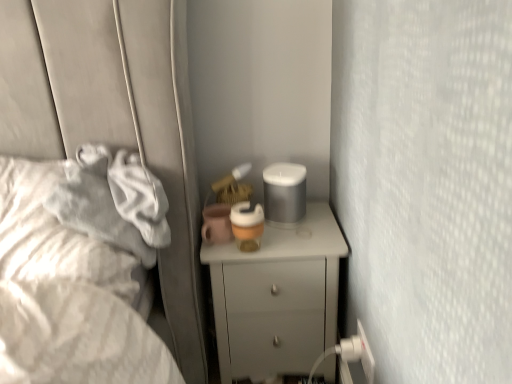
The height and width of the screenshot is (384, 512). Describe the element at coordinates (67, 295) in the screenshot. I see `white soft fabric at left` at that location.

At what (x,y) coordinates should I click in order to perform the action: click on white plastic electric outlet at lower right. Please return your answer as a coordinate pair (x, y). The image size is (512, 384). Looking at the image, I should click on (356, 356).

You are a GUI agent. You are given a task and a screenshot of the screen. Output one action in this format:
    pyautogui.click(x=<x>, y=<y>)
    Task: Click on the white soft fabric at left
    The image size is (512, 384).
    Given the screenshot: What is the action you would take?
    pyautogui.click(x=67, y=295)

From a real-world perspective, does white glossy chest of drawers at center sit lower than white soft fabric at left?

Yes, from a real-world perspective, white glossy chest of drawers at center is under white soft fabric at left.

Is white glossy chest of drawers at center positioned behind white soft fabric at left?

Yes, it is behind white soft fabric at left.

Can you tell me how much white glossy chest of drawers at center and white soft fabric at left differ in facing direction?

The angular difference between white glossy chest of drawers at center and white soft fabric at left is 2.93 degrees.

From the picture: Is white glossy chest of drawers at center smaller than white soft fabric at left?

Yes, white glossy chest of drawers at center is smaller than white soft fabric at left.

Could you tell me if white glossy chest of drawers at center is facing white plastic electric outlet at lower right?

→ Yes.

Can you confirm if white glossy chest of drawers at center is taller than white plastic electric outlet at lower right?

Correct, white glossy chest of drawers at center is much taller as white plastic electric outlet at lower right.

Between white glossy chest of drawers at center and white plastic electric outlet at lower right, which one is positioned in front?

Positioned in front is white plastic electric outlet at lower right.

From a real-world perspective, which object rests below the other?

In real-world perspective, white glossy chest of drawers at center is lower.

Does white soft fabric at left appear on the left side of white glossy chest of drawers at center?

Indeed, white soft fabric at left is positioned on the left side of white glossy chest of drawers at center.

Would you consider white soft fabric at left to be distant from white glossy chest of drawers at center?

No, white soft fabric at left is not far away from white glossy chest of drawers at center.

Is white soft fabric at left located outside white glossy chest of drawers at center?

Yes, white soft fabric at left is outside of white glossy chest of drawers at center.

From a real-world perspective, is white plastic electric outlet at lower right physically above white soft fabric at left?

No.

Based on the photo, is white soft fabric at left completely or partially inside white plastic electric outlet at lower right?

No, white soft fabric at left is not a part of white plastic electric outlet at lower right.

Which object is positioned more to the right, white plastic electric outlet at lower right or white soft fabric at left?

white plastic electric outlet at lower right.

Identify the location of chest of drawers on the left of white plastic electric outlet at lower right. The image size is (512, 384). (277, 297).

From the image's perspective, is white plastic electric outlet at lower right over white glossy chest of drawers at center?

Incorrect, from the image's perspective, white plastic electric outlet at lower right is lower than white glossy chest of drawers at center.

Which object is more forward, white plastic electric outlet at lower right or white glossy chest of drawers at center?

Positioned in front is white plastic electric outlet at lower right.

Can you confirm if white plastic electric outlet at lower right is positioned to the right of white glossy chest of drawers at center?

Indeed, white plastic electric outlet at lower right is positioned on the right side of white glossy chest of drawers at center.

Considering their positions, is white soft fabric at left located in front of or behind white plastic electric outlet at lower right?

Clearly, white soft fabric at left is in front of white plastic electric outlet at lower right.

Identify the location of bed lying in front of the white plastic electric outlet at lower right. This screenshot has height=384, width=512. (67, 295).

From a real-world perspective, is white soft fabric at left over white plastic electric outlet at lower right?

Yes.

Identify the location of bed above the white glossy chest of drawers at center (from a real-world perspective). Image resolution: width=512 pixels, height=384 pixels. (67, 295).

At what (x,y) coordinates should I click in order to perform the action: click on electric outlet lying in front of the white glossy chest of drawers at center. Please return your answer as a coordinate pair (x, y). Image resolution: width=512 pixels, height=384 pixels. Looking at the image, I should click on (x=356, y=356).

Estimate the real-world distances between objects in this image. Which object is further from white soft fabric at left, white glossy chest of drawers at center or white plastic electric outlet at lower right?

Among the two, white plastic electric outlet at lower right is located further to white soft fabric at left.

Considering their positions, is white plastic electric outlet at lower right positioned further to white glossy chest of drawers at center than white soft fabric at left?

white soft fabric at left lies further to white glossy chest of drawers at center than the other object.

Considering their positions, is white soft fabric at left positioned further to white plastic electric outlet at lower right than white glossy chest of drawers at center?

white soft fabric at left is positioned further to the anchor white plastic electric outlet at lower right.

When comparing their distances from white glossy chest of drawers at center, does white soft fabric at left or white plastic electric outlet at lower right seem closer?

white plastic electric outlet at lower right.

When comparing their distances from white soft fabric at left, does white plastic electric outlet at lower right or white glossy chest of drawers at center seem closer?

Based on the image, white glossy chest of drawers at center appears to be nearer to white soft fabric at left.

From the image, which object appears to be farther from white plastic electric outlet at lower right, white glossy chest of drawers at center or white soft fabric at left?

white soft fabric at left lies further to white plastic electric outlet at lower right than the other object.

Where is `chest of drawers between white soft fabric at left and white plastic electric outlet at lower right from left to right`? Image resolution: width=512 pixels, height=384 pixels. chest of drawers between white soft fabric at left and white plastic electric outlet at lower right from left to right is located at coordinates (277, 297).